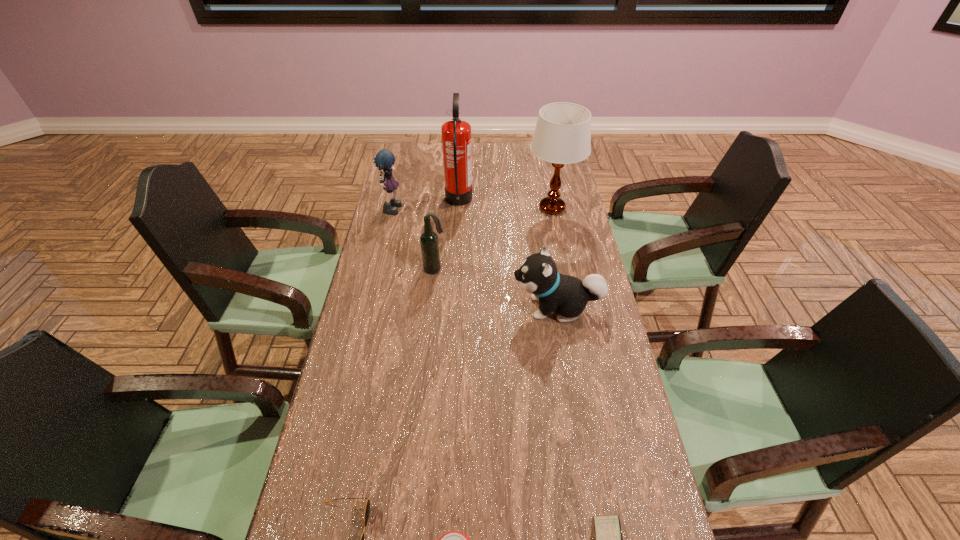
Where is `vacant space in between the fire extinguisher and the rag doll`? The width and height of the screenshot is (960, 540). vacant space in between the fire extinguisher and the rag doll is located at coordinates (426, 204).

Find the location of a particular element. The width and height of the screenshot is (960, 540). free space between the rag doll and the puppy is located at coordinates (475, 257).

Where is `free space between the table lamp and the fire extinguisher`? The width and height of the screenshot is (960, 540). free space between the table lamp and the fire extinguisher is located at coordinates tap(506, 205).

Identify which object is the second closest to the beer can. Please provide its 2D coordinates. Your answer should be formatted as a tuple, i.e. [(x, y)], where the tuple contains the x and y coordinates of a point satisfying the conditions above.

[(608, 533)]

You are a GUI agent. You are given a task and a screenshot of the screen. Output one action in this format:
    pyautogui.click(x=<x>, y=<y>)
    Task: Click on the object that can be found as the closest to the table lamp
    Image resolution: width=960 pixels, height=540 pixels.
    Given the screenshot: What is the action you would take?
    pyautogui.click(x=456, y=134)

Image resolution: width=960 pixels, height=540 pixels. Find the location of `vacant point that satisfies the following two spatial constraints: 1. on the front-facing side of the rag doll; 2. on the left side of the beer bottle`. vacant point that satisfies the following two spatial constraints: 1. on the front-facing side of the rag doll; 2. on the left side of the beer bottle is located at coordinates (378, 269).